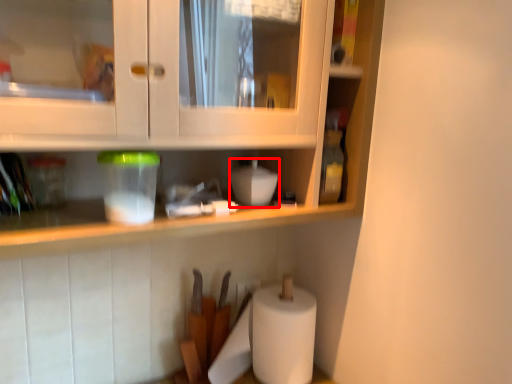
Question: In this image, where is appliance (annotated by the red box) located relative to appliance?

Choices:
 (A) right
 (B) left

Answer: (A)